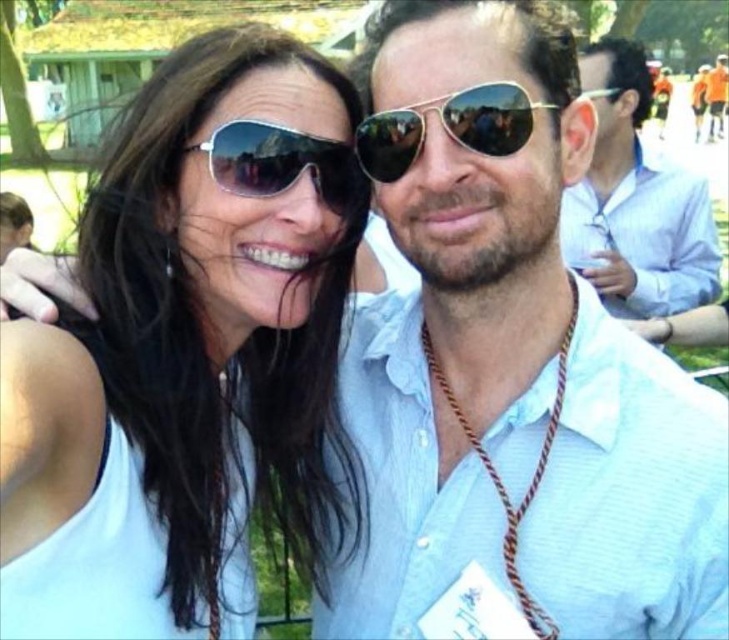
You are trying to decide which person to focus on in the photo. The matte white tank top at center and the light blue shirt at right are both visible. Which one takes up more space in the image?

The light blue shirt at right takes up more space in the image than the matte white tank top at center because the matte white tank top at center occupies less space than light blue shirt at right.

You are standing at the point with coordinates point (585,90) and want to move towards the point with coordinates point (593,524). Is the point you want to reach located in front of you or behind you?

The point (593,524) is in front of point (585,90), so the point you want to reach is located in front of you.

You are a photographer trying to capture a clear shot of the light blue shirt at right and the gold reflective aviator sunglasses at center. Which object is positioned higher in the image?

The light blue shirt at right is positioned higher in the image than the gold reflective aviator sunglasses at center, as stated in the description.